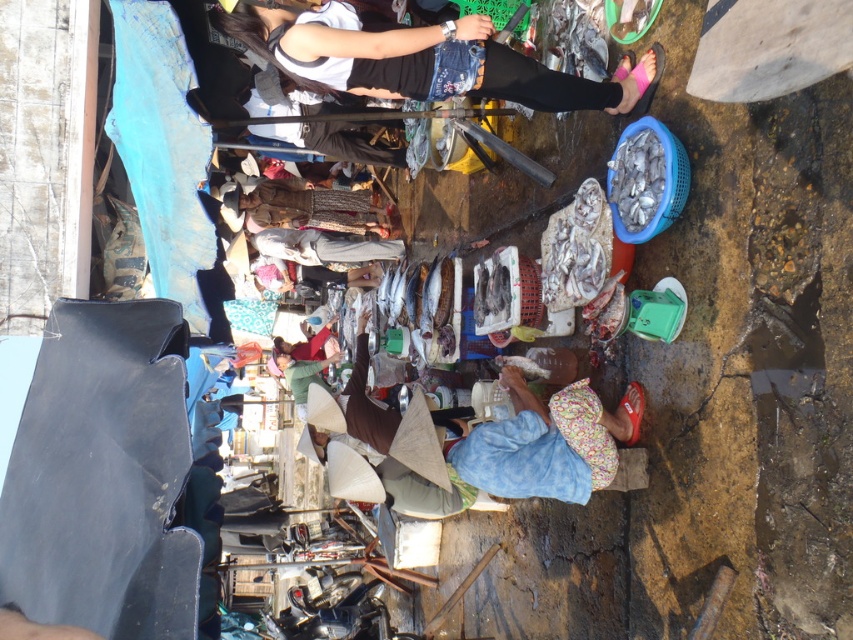
Consider the image. You are a photographer standing in the market and want to take a photo of the denim pants at upper center and the red fabric shirt at center. Which clothing item will appear larger in the photo?

The denim pants at upper center is taller than the red fabric shirt at center, so it will appear larger in the photo.

In the scene shown: You are a customer at the market and want to buy the light gray fabric pants at center and the red fabric shirt at center. The vendor asks if you want the taller item first. Which one should you choose?

The red fabric shirt at center is taller than the light gray fabric pants at center, so you should choose the red fabric shirt at center first.

You are a tailor observing a customer wearing light gray fabric pants at center and red fabric shirt at center. Which clothing item has a larger width measurement?

The light gray fabric pants at center might be wider than red fabric shirt at center according to the description.